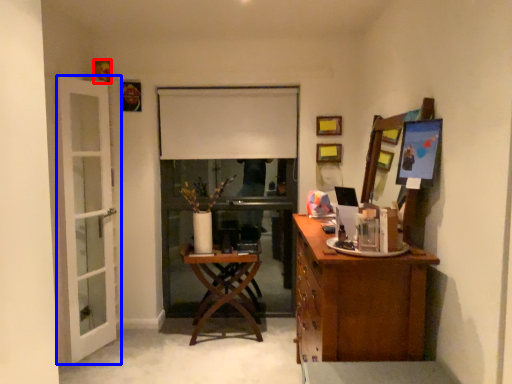
Question: Among these objects, which one is farthest to the camera, picture frame (highlighted by a red box) or door (highlighted by a blue box)?

Choices:
 (A) picture frame
 (B) door

Answer: (A)